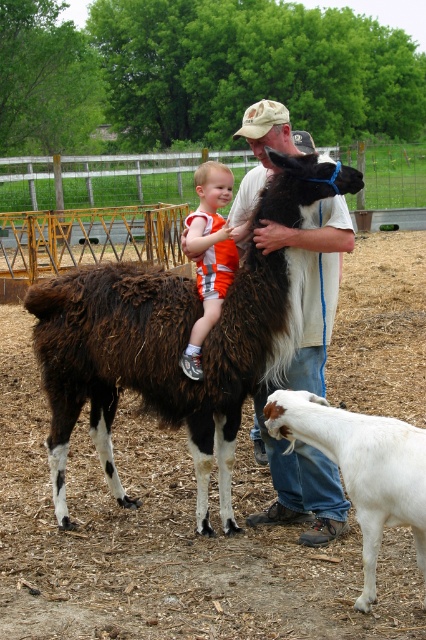
Does light brown cotton shirt at center come behind white woolen goat at lower right?

Yes, it is behind white woolen goat at lower right.

Looking at this image, is light brown cotton shirt at center to the right of white woolen goat at lower right from the viewer's perspective?

No, light brown cotton shirt at center is not to the right of white woolen goat at lower right.

Is point (238, 208) behind point (383, 442)?

Yes.

I want to click on light brown cotton shirt at center, so click(313, 284).

Can you confirm if white fluffy goat at lower right is thinner than light brown cotton shirt at center?

No.

Who is positioned more to the left, white fluffy goat at lower right or light brown cotton shirt at center?

white fluffy goat at lower right

Between point (58, 499) and point (258, 116), which one is positioned behind?

Positioned behind is point (58, 499).

Identify the location of white fluffy goat at lower right. This screenshot has width=426, height=640. (163, 358).

Between point (46, 288) and point (196, 230), which one is positioned in front?

Point (196, 230)

Does point (230, 308) lie behind point (192, 214)?

That is False.

Where is `white fluffy goat at lower right`? This screenshot has height=640, width=426. white fluffy goat at lower right is located at coordinates (163, 358).